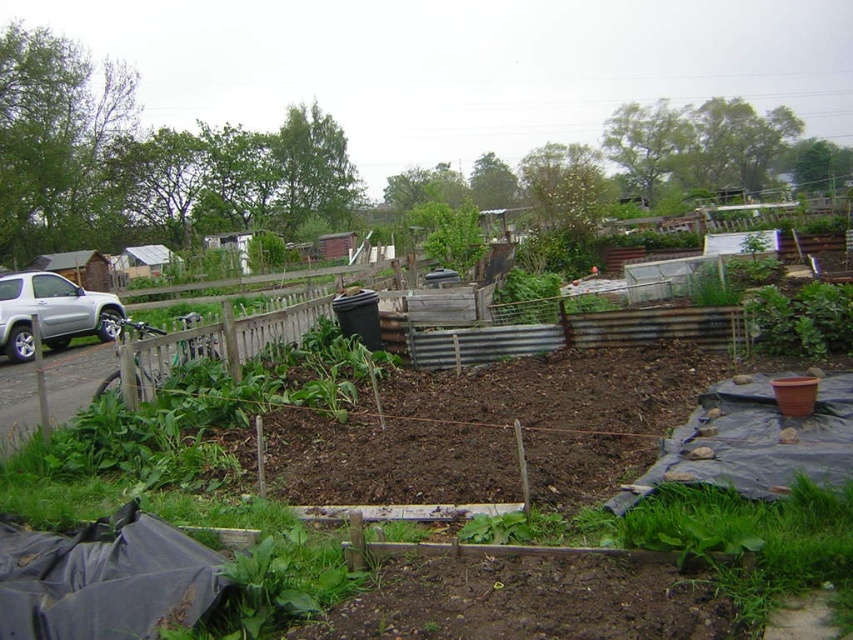
Question: Is silver metallic suv at left below green leafy plant at center-right?

Choices:
 (A) no
 (B) yes

Answer: (A)

Question: Among these objects, which one is farthest from the camera?

Choices:
 (A) silver metallic suv at left
 (B) green leafy plant at center-right

Answer: (A)

Question: Where is silver metallic suv at left located in relation to green leafy plant at center-right in the image?

Choices:
 (A) right
 (B) left

Answer: (B)

Question: Which point is farther to the camera?

Choices:
 (A) (10, 339)
 (B) (820, 291)

Answer: (A)

Question: Does silver metallic suv at left have a larger size compared to green leafy plant at center-right?

Choices:
 (A) no
 (B) yes

Answer: (B)